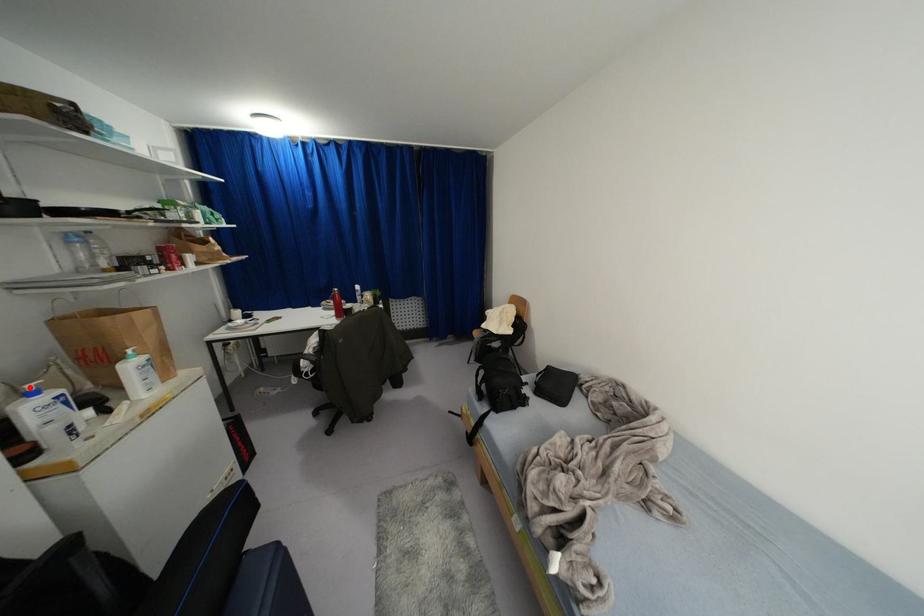
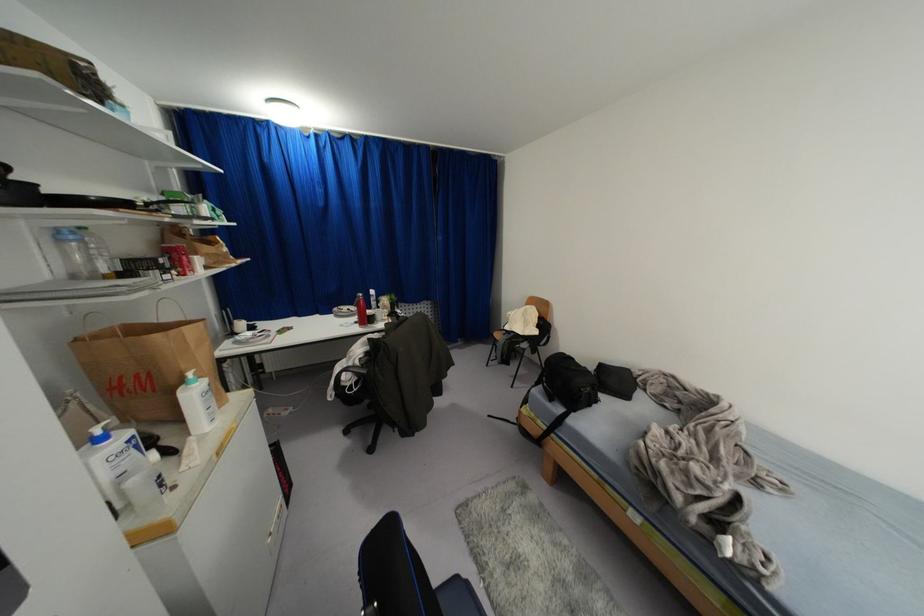
Where in the second image is the point corresponding to the highlighted location from the first image?

(98, 431)